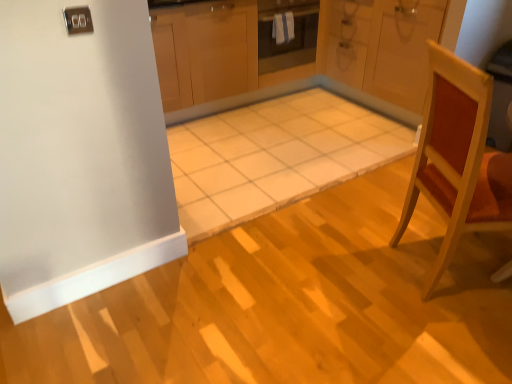
Find the location of a particular element. wooden chair at right is located at coordinates (458, 158).

Describe the element at coordinates (458, 158) in the screenshot. I see `wooden chair at right` at that location.

In order to click on wooden chair at right in this screenshot , I will do `click(458, 158)`.